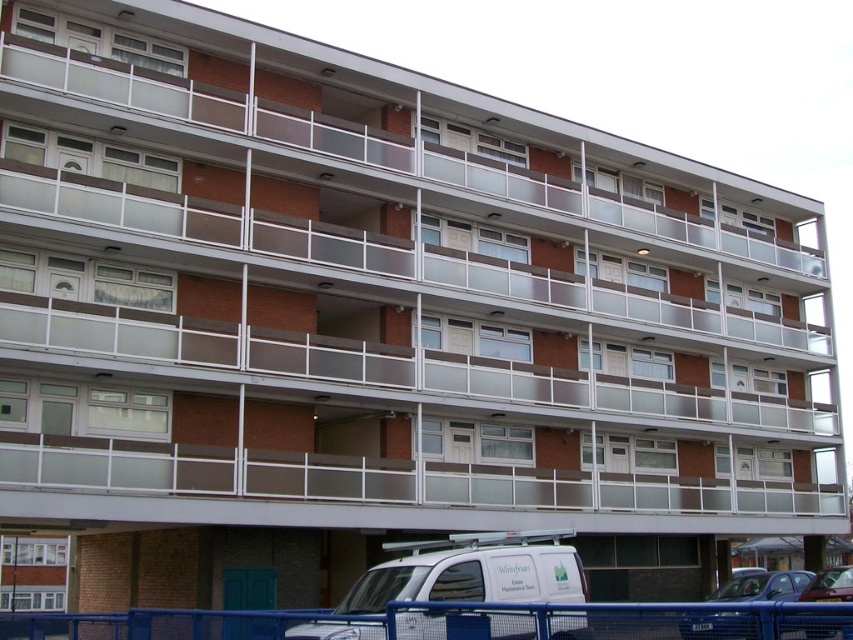
Question: Is white glass balcony at upper center further to camera compared to white matte van at lower center?

Choices:
 (A) yes
 (B) no

Answer: (A)

Question: Considering the relative positions of metallic blue car at lower right and metallic silver car at lower right in the image provided, where is metallic blue car at lower right located with respect to metallic silver car at lower right?

Choices:
 (A) above
 (B) below

Answer: (A)

Question: Is white glass balcony at upper center positioned at the back of metallic silver car at lower right?

Choices:
 (A) yes
 (B) no

Answer: (A)

Question: Among these objects, which one is farthest from the camera?

Choices:
 (A) metallic silver car at lower right
 (B) white matte van at lower center
 (C) white glass balcony at upper center
 (D) metallic blue car at lower right

Answer: (C)

Question: Which object is farther from the camera taking this photo?

Choices:
 (A) white glass balcony at upper center
 (B) metallic blue car at lower right
 (C) white matte van at lower center

Answer: (A)

Question: Which point appears farthest from the camera in this image?

Choices:
 (A) (514, 573)
 (B) (843, 579)
 (C) (364, 125)

Answer: (C)